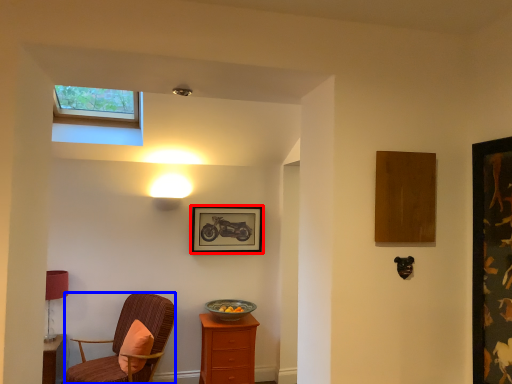
Question: Which object is further to the camera taking this photo, picture frame (highlighted by a red box) or chair (highlighted by a blue box)?

Choices:
 (A) picture frame
 (B) chair

Answer: (A)